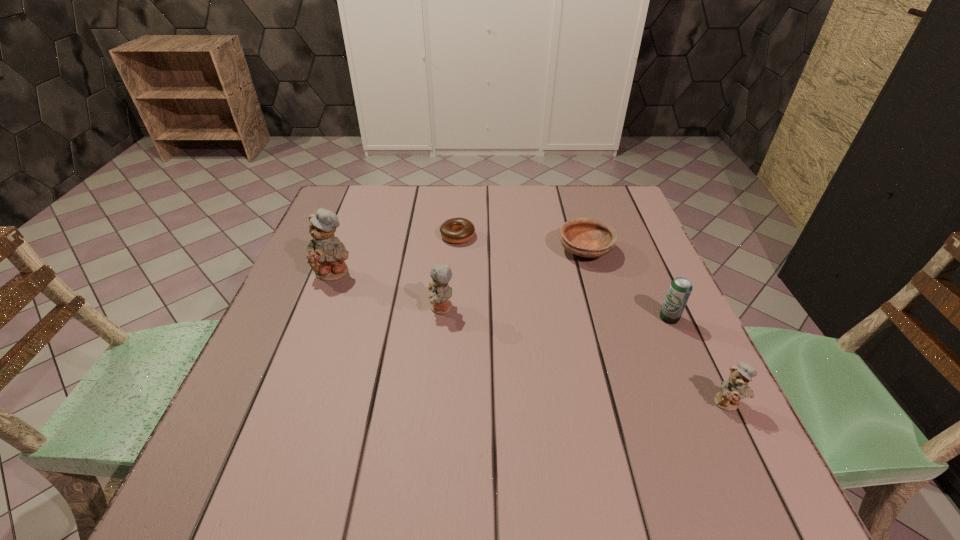
The image size is (960, 540). Identify the location of vacant area between the shortest object and the leftmost teddy bear. (396, 254).

Locate an element on the screen. vacant area that lies between the leftmost teddy bear and the rightmost teddy bear is located at coordinates (531, 338).

Where is `free area in between the doughnut and the beer can`? free area in between the doughnut and the beer can is located at coordinates (564, 277).

Identify the location of free space between the beer can and the leftmost teddy bear. This screenshot has width=960, height=540. (502, 295).

I want to click on free space between the bowl and the doughnut, so click(521, 243).

The image size is (960, 540). Find the location of `vacant area that lies between the second tallest object and the beer can`. vacant area that lies between the second tallest object and the beer can is located at coordinates (555, 313).

Locate an element on the screen. vacant space that's between the second shortest teddy bear and the nearest object is located at coordinates (585, 355).

Locate an element on the screen. Image resolution: width=960 pixels, height=540 pixels. free spot between the beer can and the tallest teddy bear is located at coordinates (502, 295).

The image size is (960, 540). Find the location of `vacant area between the shortest object and the second shortest object`. vacant area between the shortest object and the second shortest object is located at coordinates (521, 243).

Locate which object ranks third in proximity to the doughnut. Please provide its 2D coordinates. Your answer should be formatted as a tuple, i.e. [(x, y)], where the tuple contains the x and y coordinates of a point satisfying the conditions above.

[(585, 237)]